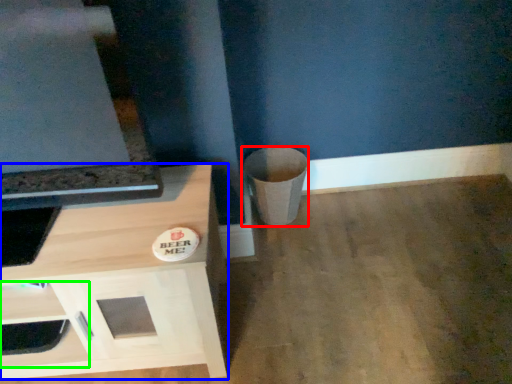
Question: Considering the real-world distances, which object is farthest from trash bin/can (highlighted by a red box)? cabinetry (highlighted by a blue box) or drawer (highlighted by a green box)?

Choices:
 (A) cabinetry
 (B) drawer

Answer: (B)